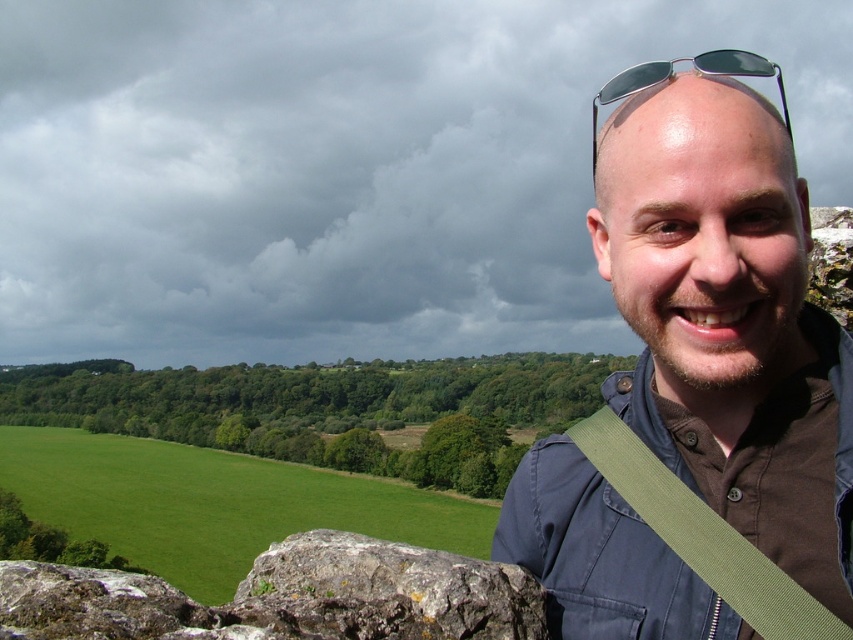
You are a photographer trying to capture a landscape shot. You notice the green grass at left and the sunglasses at upper center in your frame. Which object is located more to the left side of the frame?

The green grass at left is positioned on the left side of sunglasses at upper center, so the green grass at left is more to the left in the frame.

You are a photographer trying to capture the person in the image. The person is standing with the green grass at left and sunglasses at upper center in your viewfinder. Which object should you adjust your focus on first to ensure the person is properly framed?

The sunglasses at upper center are above the green grass at left, so you should focus on the sunglasses at upper center first to ensure proper framing of the person.